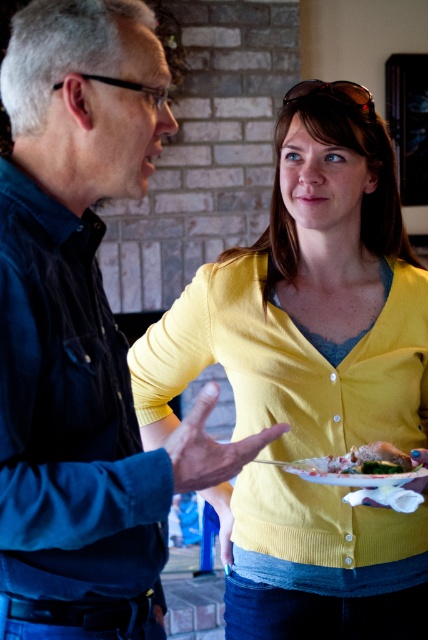
You are standing at the point marked as point (76,152) in the image. You want to reach the door located at the opposite side of the room without moving closer than 3 feet to any person in the scene. Can you safely proceed to the door?

The distance between you and the viewer is 3.54 feet, which is greater than the required 3 feet safety distance. Therefore, you can safely proceed to the door as long as you maintain this distance throughout your path.

You are a waiter in a cafe and you see the point at coordinates (369, 460). What object is located at that point?

The point at coordinates (369, 460) corresponds to the shiny silver plate at center.